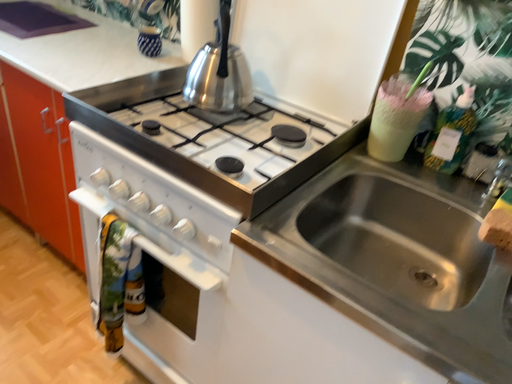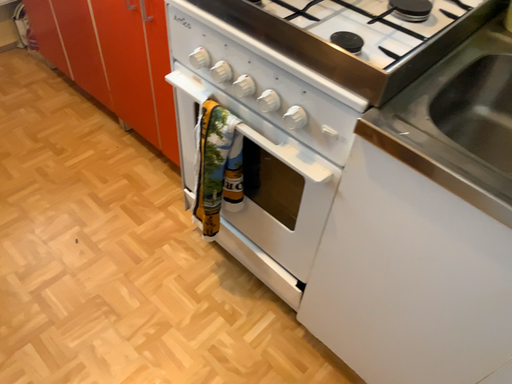
Question: Which way did the camera rotate in the video?

Choices:
 (A) rotated left
 (B) rotated right

Answer: (A)